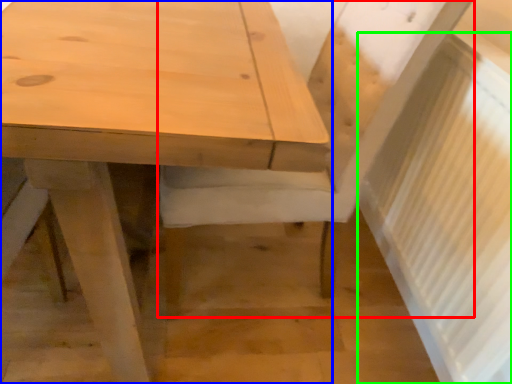
Question: Which is farther away from chair (highlighted by a red box)? table (highlighted by a blue box) or radiator (highlighted by a green box)?

Choices:
 (A) table
 (B) radiator

Answer: (A)